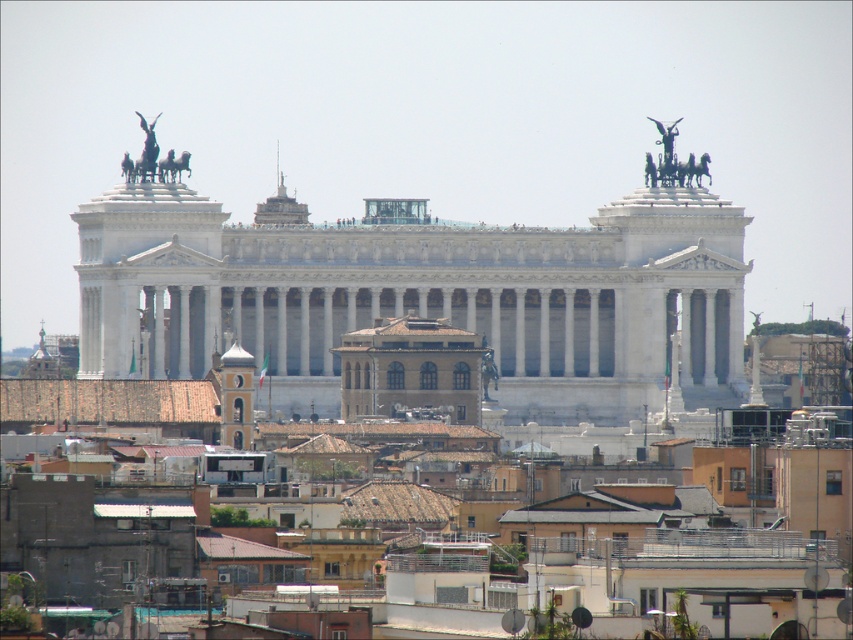
Question: Which point is closer to the camera taking this photo?

Choices:
 (A) (144, 163)
 (B) (242, 378)
 (C) (654, 177)
 (D) (161, 164)

Answer: (B)

Question: Observing the image, what is the correct spatial positioning of polished bronze chariot at upper left in reference to polished bronze horse at upper left?

Choices:
 (A) below
 (B) above

Answer: (A)

Question: From the image, what is the correct spatial relationship of polished bronze chariot at upper right in relation to polished bronze chariot at upper left?

Choices:
 (A) below
 (B) above

Answer: (B)

Question: From the image, what is the correct spatial relationship of polished bronze chariot at upper left in relation to polished bronze horse at upper left?

Choices:
 (A) left
 (B) right

Answer: (B)

Question: Which object is positioned farthest from the polished bronze chariot at upper left?

Choices:
 (A) smooth gray tower at center
 (B) polished bronze chariot at upper right
 (C) polished bronze horse at upper left

Answer: (B)

Question: Which of the following is the closest to the observer?

Choices:
 (A) polished bronze chariot at upper right
 (B) polished bronze chariot at upper left

Answer: (B)